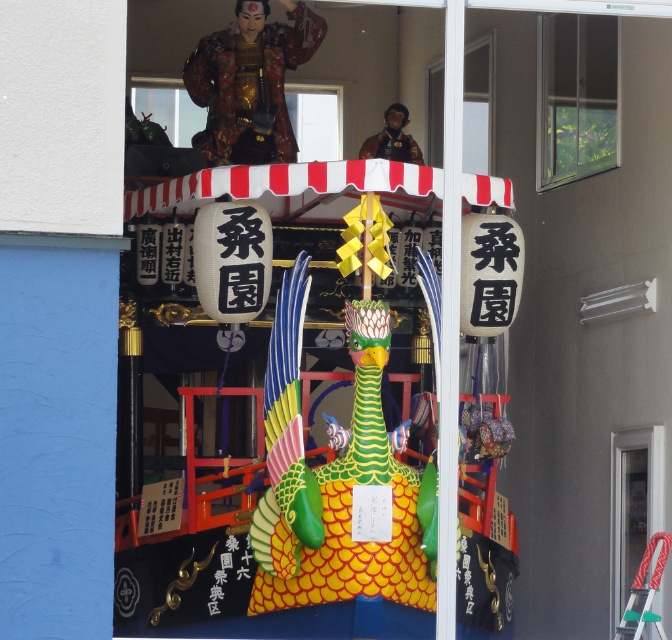
Can you confirm if shiny green and yellow fish at center is thinner than transparent glass statue at upper center?

Correct, shiny green and yellow fish at center's width is less than transparent glass statue at upper center's.

Find the location of a particular element. shiny green and yellow fish at center is located at coordinates (331, 477).

Is point (345, 492) positioned before point (319, 124)?

Yes, point (345, 492) is closer to viewer.

Image resolution: width=672 pixels, height=640 pixels. I want to click on shiny green and yellow fish at center, so click(331, 477).

Is clear glass window at upper right in front of transparent glass door at right?

No, clear glass window at upper right is behind transparent glass door at right.

Does clear glass window at upper right appear on the right side of transparent glass door at right?

Incorrect, clear glass window at upper right is not on the right side of transparent glass door at right.

Who is more distant from viewer, (607, 80) or (624, 513)?

The point (607, 80) is more distant.

You are a GUI agent. You are given a task and a screenshot of the screen. Output one action in this format:
    pyautogui.click(x=<x>, y=<y>)
    Task: Click on the clear glass window at upper right
    The width and height of the screenshot is (672, 640).
    Given the screenshot: What is the action you would take?
    pyautogui.click(x=575, y=97)

Between clear glass window at upper right and transparent glass statue at upper center, which one appears on the left side from the viewer's perspective?

transparent glass statue at upper center

Which is more to the right, clear glass window at upper right or transparent glass statue at upper center?

From the viewer's perspective, clear glass window at upper right appears more on the right side.

You are a GUI agent. You are given a task and a screenshot of the screen. Output one action in this format:
    pyautogui.click(x=<x>, y=<y>)
    Task: Click on the clear glass window at upper right
    
    Given the screenshot: What is the action you would take?
    pyautogui.click(x=575, y=97)